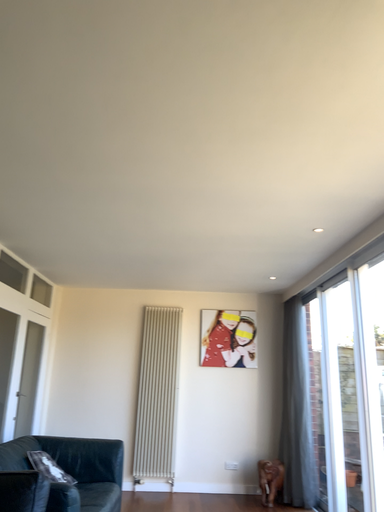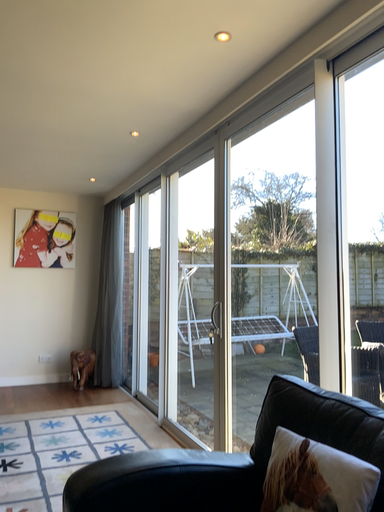
Question: How did the camera likely rotate when shooting the video?

Choices:
 (A) rotated left
 (B) rotated right

Answer: (B)